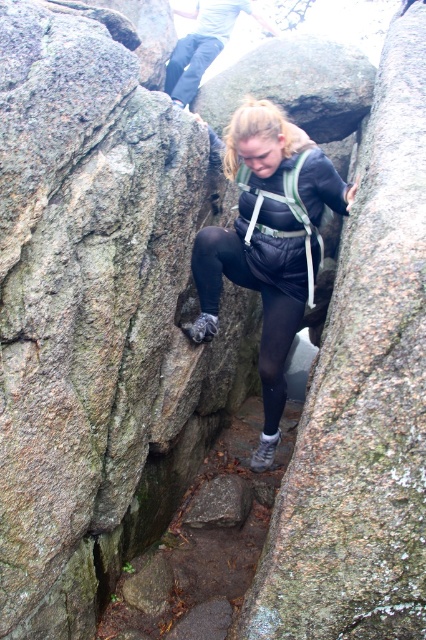
Can you confirm if black matte leggings at center is smaller than matte gray pants at upper center?

Correct, black matte leggings at center occupies less space than matte gray pants at upper center.

Which is above, black matte leggings at center or matte gray pants at upper center?

matte gray pants at upper center is higher up.

Which is in front, point (279, 308) or point (172, 92)?

Point (279, 308) is in front.

This screenshot has height=640, width=426. What are the coordinates of `black matte leggings at center` in the screenshot? It's located at (262, 308).

Can you confirm if black matte jumpsuit at center is bigger than matte gray pants at upper center?

No, black matte jumpsuit at center is not bigger than matte gray pants at upper center.

Does black matte jumpsuit at center have a smaller size compared to matte gray pants at upper center?

Indeed, black matte jumpsuit at center has a smaller size compared to matte gray pants at upper center.

Which is in front, point (304, 308) or point (178, 96)?

Point (304, 308) is in front.

At what (x,y) coordinates should I click in order to perform the action: click on black matte jumpsuit at center. Please return your answer as a coordinate pair (x, y). This screenshot has width=426, height=640. Looking at the image, I should click on (267, 243).

This screenshot has width=426, height=640. Describe the element at coordinates (267, 243) in the screenshot. I see `black matte jumpsuit at center` at that location.

Is black matte jumpsuit at center above black matte leggings at center?

Yes.

Does point (255, 284) lie behind point (233, 259)?

Yes.

Where is `black matte jumpsuit at center`? The width and height of the screenshot is (426, 640). black matte jumpsuit at center is located at coordinates (267, 243).